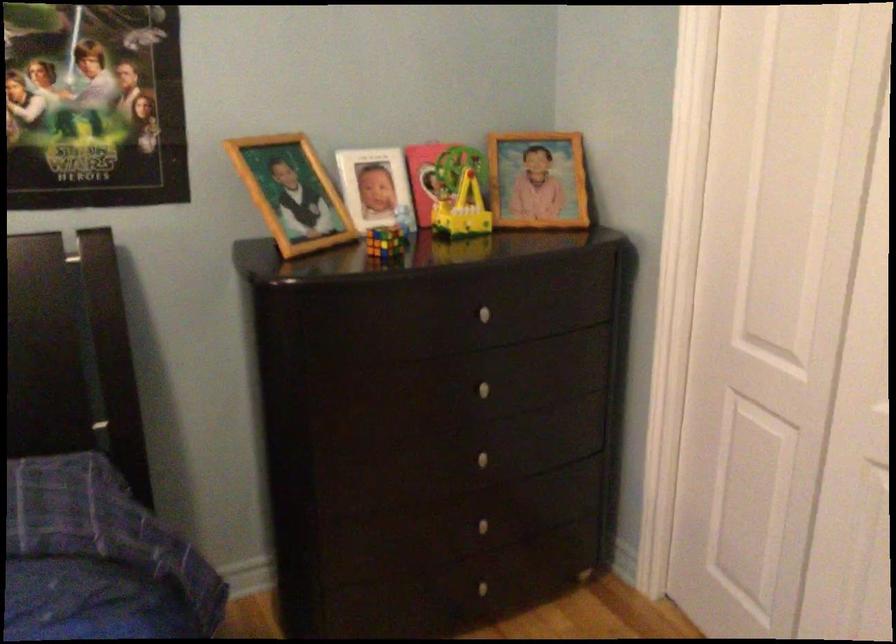
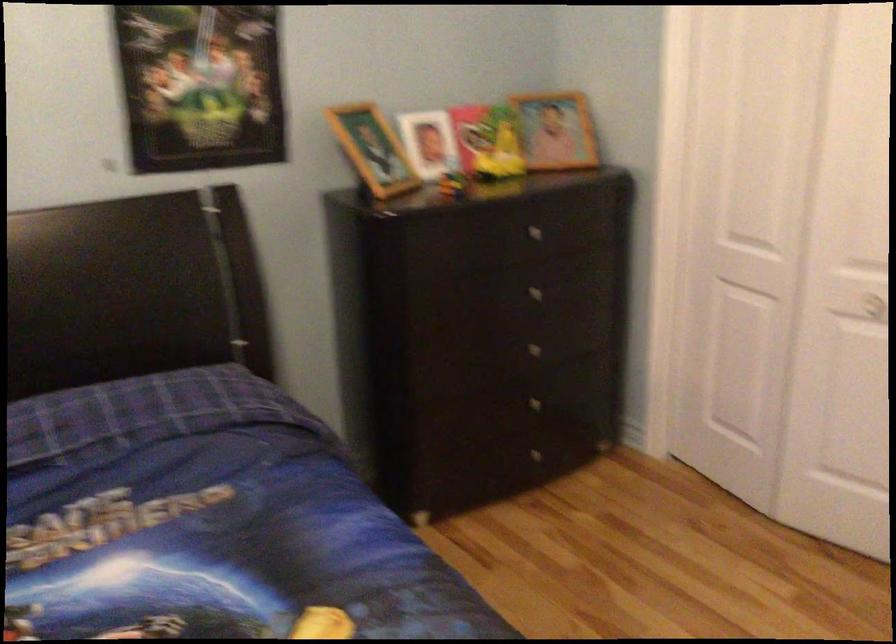
Locate, in the second image, the point that corresponds to [543,181] in the first image.

(556, 129)